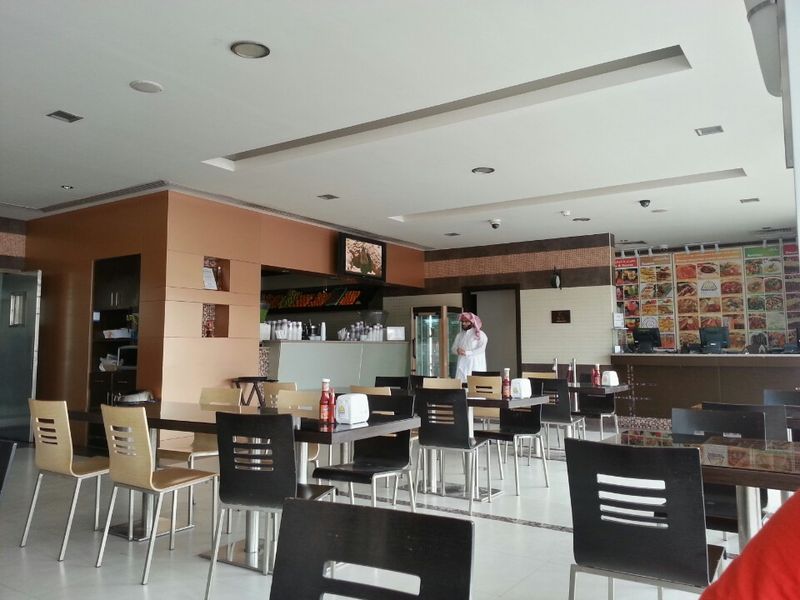
I want to click on tan chairs, so click(141, 470), click(49, 458), click(220, 395), click(289, 396), click(486, 383).